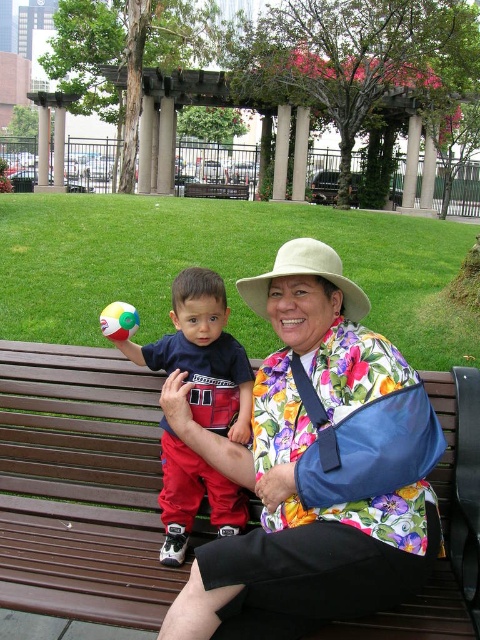
Question: Is matte blue shirt at center closer to the viewer compared to beige fabric cowboy hat at center?

Choices:
 (A) yes
 (B) no

Answer: (B)

Question: Which point is closer to the camera?

Choices:
 (A) (207, 196)
 (B) (361, 317)
 (C) (108, 324)
 (D) (278, 417)

Answer: (D)

Question: Which of the following is the closest to the observer?

Choices:
 (A) (204, 195)
 (B) (111, 326)
 (C) (181, 316)
 (D) (336, 516)

Answer: (D)

Question: Does floral fabric shirt at center appear on the left side of brown wooden bench at center?

Choices:
 (A) no
 (B) yes

Answer: (A)

Question: Can you confirm if matte blue shirt at center is positioned below brown wooden bench at center?

Choices:
 (A) yes
 (B) no

Answer: (A)

Question: Which point is closer to the camera taking this photo?

Choices:
 (A) (259, 282)
 (B) (100, 320)
 (C) (230, 483)
 (D) (304, 248)

Answer: (D)